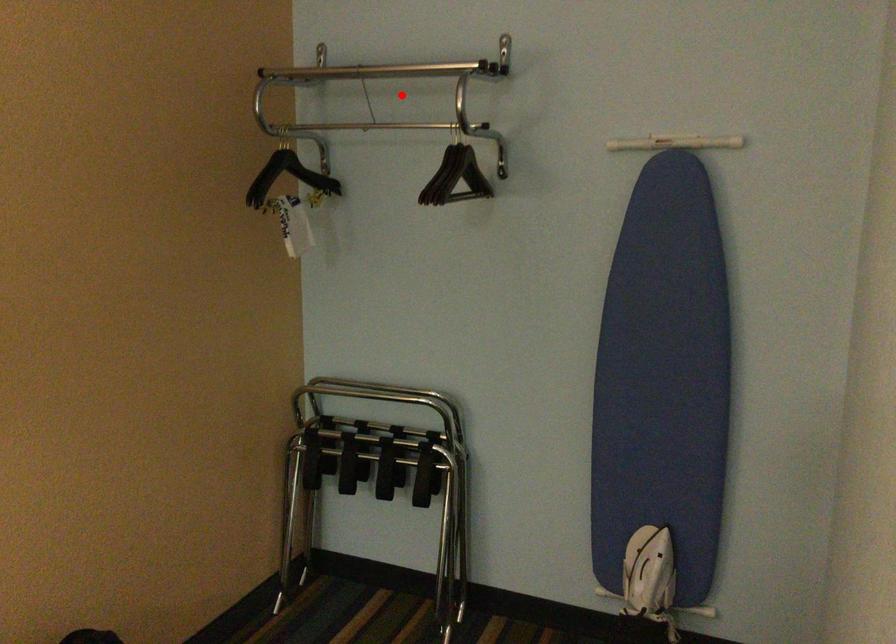
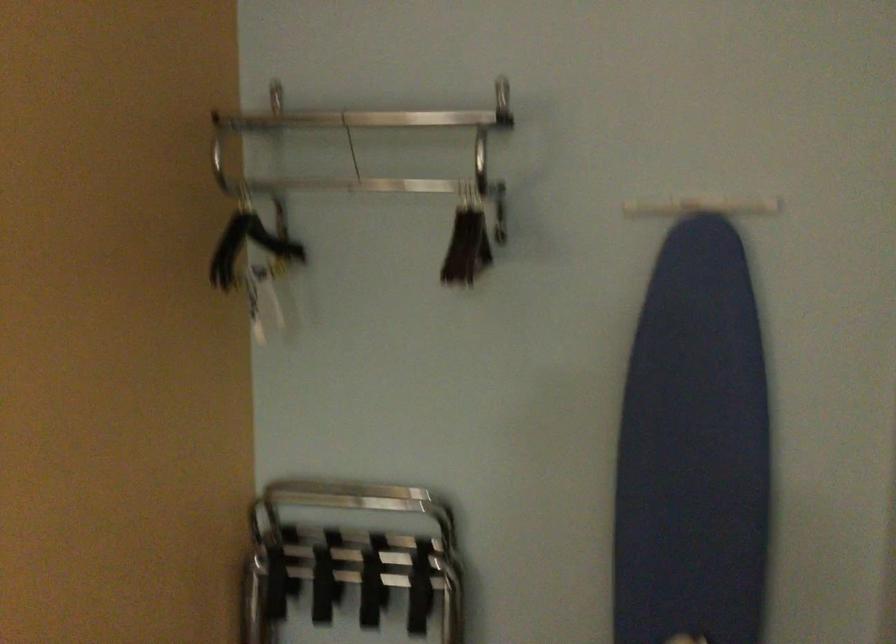
Question: I am providing you with two images of the same scene from different viewpoints. A red point is marked on the first image. Is the red point's position out of view in image 2?

Choices:
 (A) Yes
 (B) No

Answer: (B)